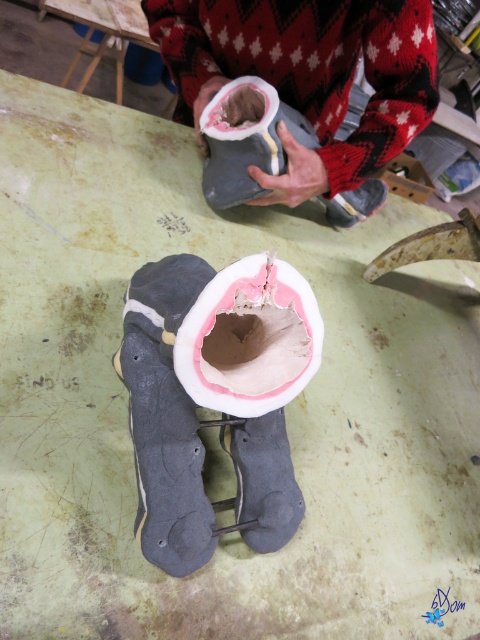
Who is lower down, matte gray boot at upper center or matte gray boot at center?

matte gray boot at center

In the scene shown: Does matte gray boot at upper center appear on the left side of matte gray boot at center?

Indeed, matte gray boot at upper center is positioned on the left side of matte gray boot at center.

You are a GUI agent. You are given a task and a screenshot of the screen. Output one action in this format:
    pyautogui.click(x=<x>, y=<y>)
    Task: Click on the matte gray boot at upper center
    The height and width of the screenshot is (640, 480).
    Given the screenshot: What is the action you would take?
    pyautogui.click(x=308, y=76)

What do you see at coordinates (308, 76) in the screenshot? The height and width of the screenshot is (640, 480). I see `matte gray boot at upper center` at bounding box center [308, 76].

Can you confirm if matte gray boot at upper center is thinner than pink clay paper plate at center?

Incorrect, matte gray boot at upper center's width is not less than pink clay paper plate at center's.

Who is more forward, (191, 77) or (284, 296)?

Point (284, 296) is more forward.

I want to click on matte gray boot at upper center, so click(308, 76).

Does matte gray boot at upper center have a smaller size compared to green matte table at upper center?

Yes.

I want to click on matte gray boot at upper center, so click(308, 76).